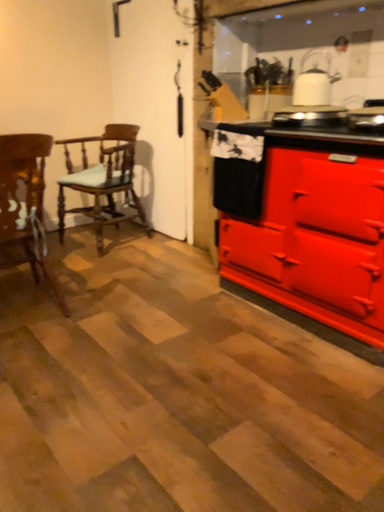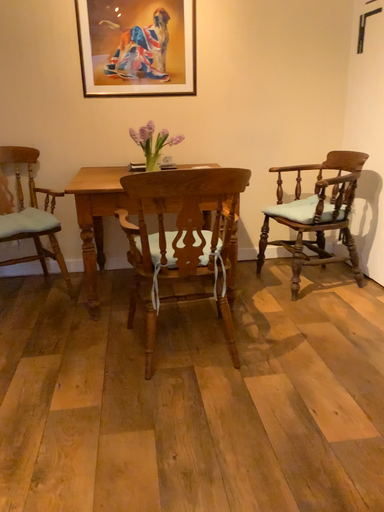
Question: How did the camera likely rotate when shooting the video?

Choices:
 (A) rotated left
 (B) rotated right

Answer: (A)